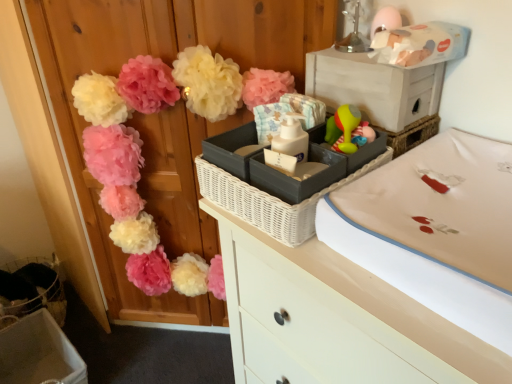
Question: Considering the relative positions of matte plastic storage box at lower left, the 2th storage box from the front, and beige fabric changing pad at center-right in the image provided, is matte plastic storage box at lower left, the 2th storage box from the front, to the right of beige fabric changing pad at center-right from the viewer's perspective?

Choices:
 (A) yes
 (B) no

Answer: (B)

Question: Can you confirm if matte plastic storage box at lower left, marked as the first storage box in a bottom-to-top arrangement, is taller than beige fabric changing pad at center-right?

Choices:
 (A) yes
 (B) no

Answer: (A)

Question: Is matte plastic storage box at lower left, arranged as the second storage box when viewed from the top, looking in the opposite direction of beige fabric changing pad at center-right?

Choices:
 (A) no
 (B) yes

Answer: (A)

Question: From a real-world perspective, is matte plastic storage box at lower left, the 2th storage box from the front, physically below beige fabric changing pad at center-right?

Choices:
 (A) no
 (B) yes

Answer: (B)

Question: From a real-world perspective, is matte plastic storage box at lower left, arranged as the second storage box when viewed from the top, on beige fabric changing pad at center-right?

Choices:
 (A) no
 (B) yes

Answer: (A)

Question: Can you confirm if matte plastic storage box at lower left, marked as the first storage box in a bottom-to-top arrangement, is wider than beige fabric changing pad at center-right?

Choices:
 (A) yes
 (B) no

Answer: (B)

Question: Is matte pink pom-poms at upper left at the back of matte plastic storage box at lower left, the 2th storage box from the front?

Choices:
 (A) no
 (B) yes

Answer: (A)

Question: Is matte plastic storage box at lower left, arranged as the 1th storage box when viewed from the left, further to camera compared to matte pink pom-poms at upper left?

Choices:
 (A) no
 (B) yes

Answer: (B)

Question: Does matte plastic storage box at lower left, arranged as the 1th storage box when viewed from the left, lie in front of matte pink pom-poms at upper left?

Choices:
 (A) yes
 (B) no

Answer: (B)

Question: Considering the relative sizes of matte plastic storage box at lower left, arranged as the 1th storage box when viewed from the left, and matte pink pom-poms at upper left in the image provided, is matte plastic storage box at lower left, arranged as the 1th storage box when viewed from the left, taller than matte pink pom-poms at upper left?

Choices:
 (A) yes
 (B) no

Answer: (B)

Question: Can you confirm if matte plastic storage box at lower left, the 2th storage box from the front, is positioned to the right of matte pink pom-poms at upper left?

Choices:
 (A) no
 (B) yes

Answer: (A)

Question: Does matte plastic storage box at lower left, the 2th storage box from the front, have a lesser width compared to matte pink pom-poms at upper left?

Choices:
 (A) yes
 (B) no

Answer: (B)

Question: From a real-world perspective, is beige fabric changing pad at center-right physically below matte plastic storage box at lower left, the 2th storage box from the front?

Choices:
 (A) no
 (B) yes

Answer: (A)